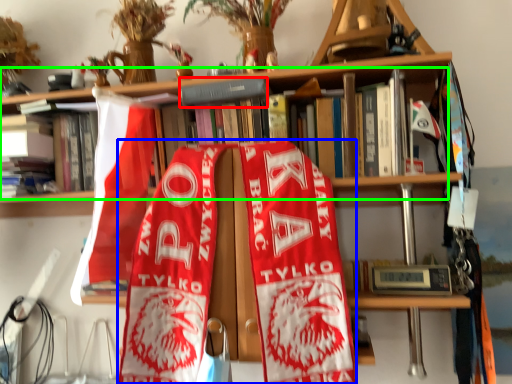
Question: Which object is the closest to the book (highlighted by a red box)? Choose among these: beach towel (highlighted by a blue box) or book (highlighted by a green box).

Choices:
 (A) beach towel
 (B) book

Answer: (B)